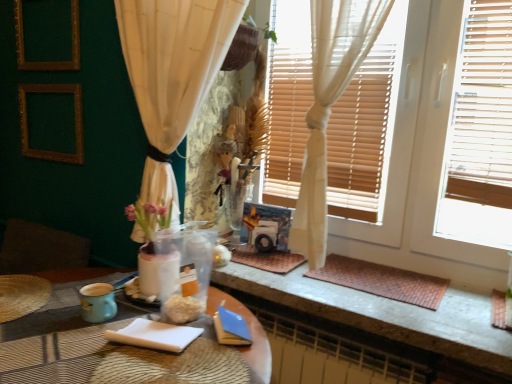
I want to click on vacant space behind white paper notepad at lower center, so click(157, 303).